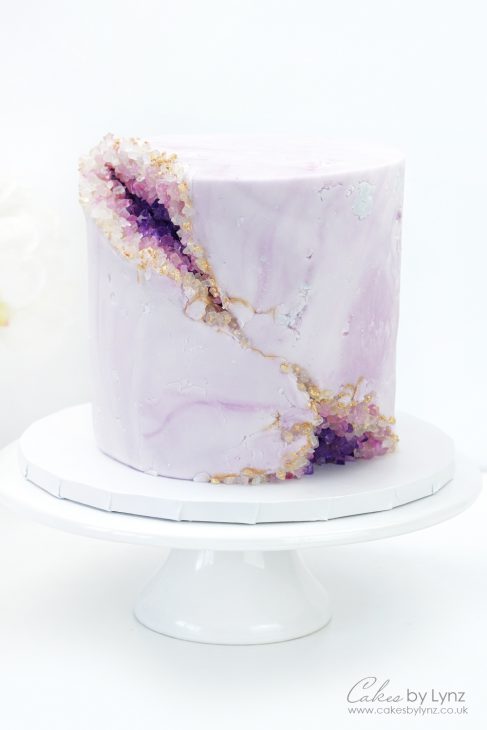
The image size is (487, 730). Identify the location of white cake stand base. (235, 596).